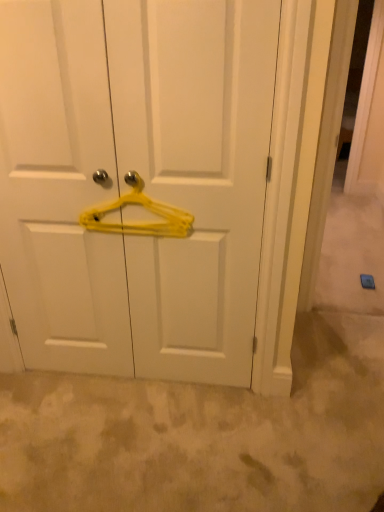
Find the location of a particular element. Image resolution: width=384 pixels, height=512 pixels. yellow plastic hanger at center is located at coordinates [x=140, y=176].

The image size is (384, 512). What do you see at coordinates (140, 176) in the screenshot?
I see `yellow plastic hanger at center` at bounding box center [140, 176].

What do you see at coordinates (143, 207) in the screenshot? This screenshot has height=512, width=384. I see `yellow plastic hanger at center` at bounding box center [143, 207].

In order to click on yellow plastic hanger at center in this screenshot , I will do `click(143, 207)`.

The width and height of the screenshot is (384, 512). I want to click on yellow plastic hanger at center, so click(140, 176).

Between yellow plastic hanger at center and yellow plastic hanger at center, which one appears on the right side from the viewer's perspective?

yellow plastic hanger at center.

Who is more distant, yellow plastic hanger at center or yellow plastic hanger at center?

yellow plastic hanger at center is further away from the camera.

Is point (156, 207) positioned after point (202, 12)?

Yes, it is.

From the image's perspective, which is below, yellow plastic hanger at center or yellow plastic hanger at center?

yellow plastic hanger at center.

From a real-world perspective, does yellow plastic hanger at center sit lower than yellow plastic hanger at center?

No, from a real-world perspective, yellow plastic hanger at center is not under yellow plastic hanger at center.

Which object is thinner, yellow plastic hanger at center or yellow plastic hanger at center?

yellow plastic hanger at center is thinner.

Considering the sizes of objects yellow plastic hanger at center and yellow plastic hanger at center in the image provided, who is taller, yellow plastic hanger at center or yellow plastic hanger at center?

yellow plastic hanger at center.

Between yellow plastic hanger at center and yellow plastic hanger at center, which one has larger size?

With larger size is yellow plastic hanger at center.

Would you say yellow plastic hanger at center is inside or outside yellow plastic hanger at center?

yellow plastic hanger at center fits inside yellow plastic hanger at center.

Would you consider yellow plastic hanger at center to be distant from yellow plastic hanger at center?

No, yellow plastic hanger at center is in close proximity to yellow plastic hanger at center.

Is yellow plastic hanger at center looking in the opposite direction of yellow plastic hanger at center?

That's right, yellow plastic hanger at center is facing away from yellow plastic hanger at center.

I want to click on door beneath the yellow plastic hanger at center (from a real-world perspective), so click(140, 176).

Based on their positions, is yellow plastic hanger at center located to the left or right of yellow plastic hanger at center?

In the image, yellow plastic hanger at center appears on the left side of yellow plastic hanger at center.

Is yellow plastic hanger at center positioned in front of yellow plastic hanger at center?

Yes, it is.

Which is behind, point (78, 252) or point (136, 223)?

The point (78, 252) is farther from the camera.

From the image's perspective, between yellow plastic hanger at center and yellow plastic hanger at center, who is located below?

yellow plastic hanger at center.

From a real-world perspective, does yellow plastic hanger at center stand above yellow plastic hanger at center?

No, from a real-world perspective, yellow plastic hanger at center is not on top of yellow plastic hanger at center.

Which object is thinner, yellow plastic hanger at center or yellow plastic hanger at center?

With smaller width is yellow plastic hanger at center.

Consider the image. Between yellow plastic hanger at center and yellow plastic hanger at center, which one has more height?

Standing taller between the two is yellow plastic hanger at center.

Does yellow plastic hanger at center have a larger size compared to yellow plastic hanger at center?

Indeed, yellow plastic hanger at center has a larger size compared to yellow plastic hanger at center.

Is yellow plastic hanger at center completely or partially inside yellow plastic hanger at center?

Yes, yellow plastic hanger at center is a part of yellow plastic hanger at center.

Looking at this image, does yellow plastic hanger at center touch yellow plastic hanger at center?

No, yellow plastic hanger at center is not in contact with yellow plastic hanger at center.

Is yellow plastic hanger at center turned away from yellow plastic hanger at center?

Yes, yellow plastic hanger at center is facing away from yellow plastic hanger at center.

Based on the photo, how many degrees apart are the facing directions of yellow plastic hanger at center and yellow plastic hanger at center?

The angular difference between yellow plastic hanger at center and yellow plastic hanger at center is 0.212 degrees.

In order to click on hanger that is on the right side of yellow plastic hanger at center in this screenshot , I will do `click(143, 207)`.

Locate an element on the screen. door in front of the yellow plastic hanger at center is located at coordinates (140, 176).

The height and width of the screenshot is (512, 384). Identify the location of door that appears on the left of yellow plastic hanger at center. (140, 176).